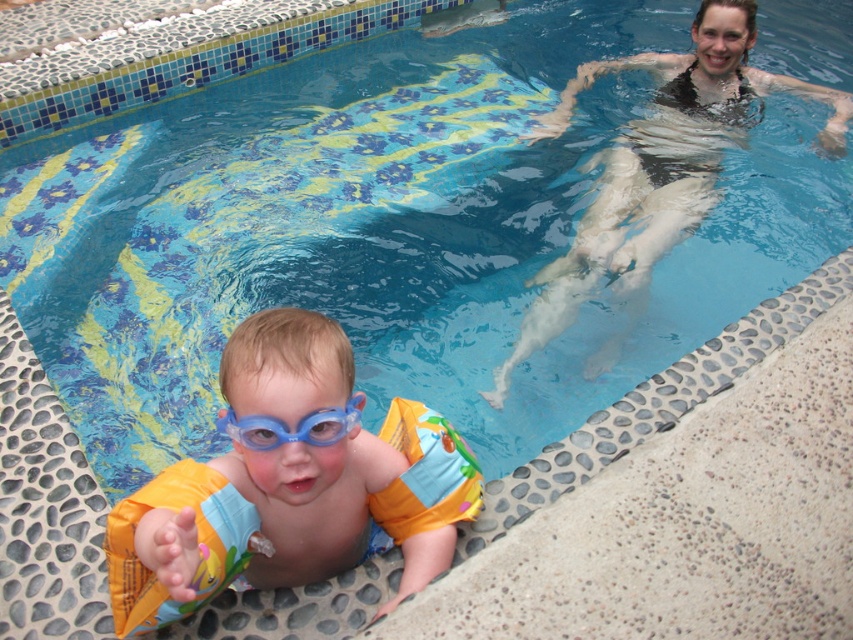
You are a lifeguard standing at the edge of the pool. You need to locate the blue rubber arm bands at lower left. According to the coordinates provided, where exactly should you look to find them?

The blue rubber arm bands at lower left are located at the 2D coordinates point (289, 483).

You are a lifeguard who needs to quickly identify the items in the pool area. Which object is wider, the matte black swimsuit at upper right or the blue rubber goggles at lower center?

The matte black swimsuit at upper right is wider than the blue rubber goggles at lower center according to the description.